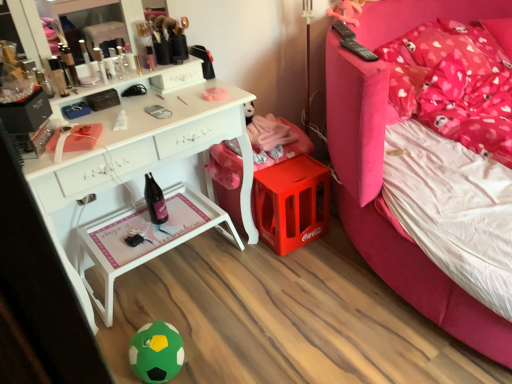
You are a GUI agent. You are given a task and a screenshot of the screen. Output one action in this format:
    pyautogui.click(x=<x>, y=<y>)
    Task: Click on the white wood tray at lower center
    This screenshot has width=512, height=384.
    Given the screenshot: What is the action you would take?
    pyautogui.click(x=146, y=237)

I want to click on green felt ball at lower center, so click(156, 352).

This screenshot has height=384, width=512. In order to click on matte black compact at upper left in this screenshot , I will do `click(58, 76)`.

At what (x,y) coordinates should I click in order to perform the action: click on pink fabric pillow at upper right. Please return your answer as a coordinate pair (x, y). The width and height of the screenshot is (512, 384). Looking at the image, I should click on (479, 41).

Considering the relative positions of white wood tray at lower center and matte black compact at upper left in the image provided, is white wood tray at lower center to the left or to the right of matte black compact at upper left?

From the image, it's evident that white wood tray at lower center is to the right of matte black compact at upper left.

Who is taller, white wood tray at lower center or matte black compact at upper left?

white wood tray at lower center is taller.

Could you tell me if white wood tray at lower center is turned towards matte black compact at upper left?

No, white wood tray at lower center does not turn towards matte black compact at upper left.

Is point (63, 90) farther from viewer compared to point (428, 309)?

No, it is not.

From the image's perspective, is matte black compact at upper left positioned above or below pink fabric bed at upper right?

From the image's perspective, matte black compact at upper left appears above pink fabric bed at upper right.

The height and width of the screenshot is (384, 512). I want to click on toiletry behind the pink fabric bed at upper right, so click(x=58, y=76).

Is pink fabric bed at upper right in front of or behind white wood tray at lower center in the image?

In the image, pink fabric bed at upper right appears in front of white wood tray at lower center.

Looking at this image, does pink fabric bed at upper right have a lesser width compared to white wood tray at lower center?

No.

Is pink fabric bed at upper right looking in the opposite direction of white wood tray at lower center?

No.

Considering the sizes of objects pink fabric bed at upper right and white wood tray at lower center in the image provided, who is shorter, pink fabric bed at upper right or white wood tray at lower center?

white wood tray at lower center is shorter.

Between green felt ball at lower center and white wood tray at lower center, which one is positioned behind?

white wood tray at lower center is more distant.

Between green felt ball at lower center and white wood tray at lower center, which one has smaller width?

green felt ball at lower center is thinner.

Is green felt ball at lower center facing towards white wood tray at lower center?

No.

Is pink fabric bed at upper right facing towards green felt ball at lower center?

No, pink fabric bed at upper right is not facing towards green felt ball at lower center.

What's the angular difference between pink fabric bed at upper right and green felt ball at lower center's facing directions?

The angle between the facing direction of pink fabric bed at upper right and the facing direction of green felt ball at lower center is 85.8 degrees.

Locate an element on the screen. toy on the left of pink fabric bed at upper right is located at coordinates (156, 352).

Would you say white wood tray at lower center is outside pink fabric bed at upper right?

white wood tray at lower center lies outside pink fabric bed at upper right's area.

Is white wood tray at lower center taller than pink fabric bed at upper right?

Incorrect, the height of white wood tray at lower center is not larger of that of pink fabric bed at upper right.

Does white wood tray at lower center have a larger size compared to pink fabric bed at upper right?

Actually, white wood tray at lower center might be smaller than pink fabric bed at upper right.

I want to click on nightstand directly beneath the pink fabric bed at upper right (from a real-world perspective), so click(x=146, y=237).

Who is more distant, green felt ball at lower center or matte black compact at upper left?

matte black compact at upper left is behind.

Looking at this image, is matte black compact at upper left a part of green felt ball at lower center?

That's incorrect, matte black compact at upper left is not inside green felt ball at lower center.

Considering the positions of objects green felt ball at lower center and matte black compact at upper left in the image provided, who is more to the right, green felt ball at lower center or matte black compact at upper left?

green felt ball at lower center is more to the right.

This screenshot has height=384, width=512. I want to click on nightstand below the matte black compact at upper left (from the image's perspective), so click(146, 237).

Locate an element on the screen. The height and width of the screenshot is (384, 512). toiletry behind the pink fabric bed at upper right is located at coordinates (58, 76).

Estimate the real-world distances between objects in this image. Which object is further from pink fabric pillow at upper right, white wood tray at lower center or green felt ball at lower center?

green felt ball at lower center is positioned further to the anchor pink fabric pillow at upper right.

Considering their positions, is pink fabric bed at upper right positioned closer to pink fabric pillow at upper right than white wood tray at lower center?

pink fabric bed at upper right.

From the image, which object appears to be nearer to pink fabric pillow at upper right, matte black compact at upper left or pink fabric bed at upper right?

pink fabric bed at upper right.

Which object lies nearer to the anchor point pink fabric pillow at upper right, matte black compact at upper left or green felt ball at lower center?

Among the two, matte black compact at upper left is located nearer to pink fabric pillow at upper right.

Considering their positions, is pink fabric pillow at upper right positioned further to pink fabric bed at upper right than matte black compact at upper left?

Among the two, pink fabric pillow at upper right is located further to pink fabric bed at upper right.

Estimate the real-world distances between objects in this image. Which object is further from pink fabric pillow at upper right, green felt ball at lower center or white wood tray at lower center?

The object further to pink fabric pillow at upper right is green felt ball at lower center.

Estimate the real-world distances between objects in this image. Which object is closer to white wood tray at lower center, green felt ball at lower center or pink fabric pillow at upper right?

Answer: The object closer to white wood tray at lower center is green felt ball at lower center.

Considering their positions, is white wood tray at lower center positioned further to pink fabric pillow at upper right than matte black compact at upper left?

matte black compact at upper left.

The width and height of the screenshot is (512, 384). What are the coordinates of `toy located between matte black compact at upper left and pink fabric pillow at upper right in the left-right direction` in the screenshot? It's located at (156, 352).

The image size is (512, 384). Identify the location of nightstand between matte black compact at upper left and pink fabric bed at upper right from left to right. (146, 237).

The height and width of the screenshot is (384, 512). I want to click on nightstand between matte black compact at upper left and green felt ball at lower center in the up-down direction, so point(146,237).

Locate an element on the screen. toy between matte black compact at upper left and pink fabric bed at upper right is located at coordinates (156, 352).